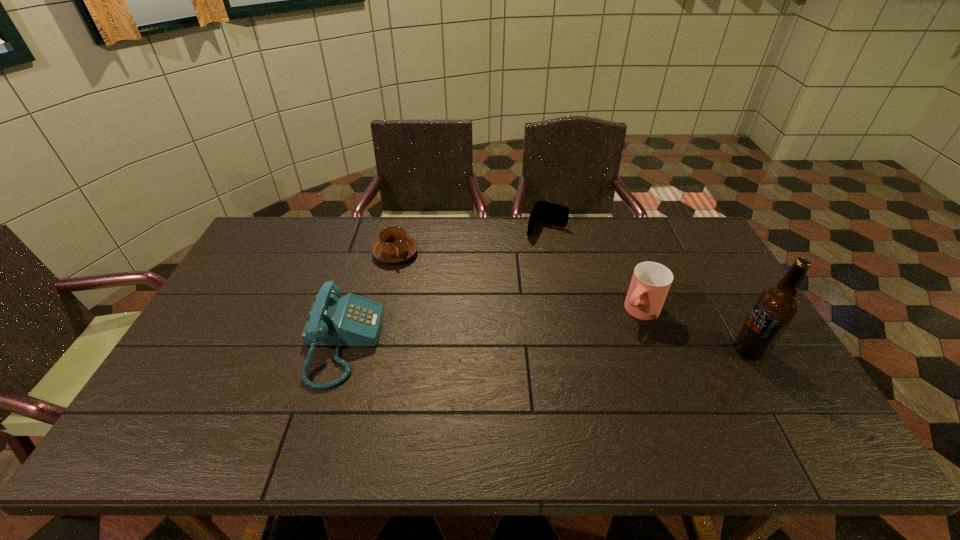
Where is `free location located on the label of the tallest object`? This screenshot has height=540, width=960. free location located on the label of the tallest object is located at coordinates (697, 350).

The image size is (960, 540). Find the location of `vacant space located on the side of the fourth object from left to right with the handle`. vacant space located on the side of the fourth object from left to right with the handle is located at coordinates (570, 379).

You are a GUI agent. You are given a task and a screenshot of the screen. Output one action in this format:
    pyautogui.click(x=<x>, y=<y>)
    Task: Click on the vacant space located 0.340m on the side of the fourth object from left to right with the handle
    This screenshot has width=960, height=540.
    Given the screenshot: What is the action you would take?
    pyautogui.click(x=556, y=394)

Where is `free space located 0.340m on the side of the fourth object from left to right with the handle`? The width and height of the screenshot is (960, 540). free space located 0.340m on the side of the fourth object from left to right with the handle is located at coordinates (556, 394).

I want to click on free space located on the side of the cappuccino with the handle, so click(479, 333).

The height and width of the screenshot is (540, 960). In order to click on free space located on the side of the cappuccino with the handle in this screenshot , I will do `click(422, 279)`.

Where is `vacant space situated on the side of the cappuccino with the handle`? The width and height of the screenshot is (960, 540). vacant space situated on the side of the cappuccino with the handle is located at coordinates (431, 287).

Locate an element on the screen. vacant space located 0.260m on the outer surface of the farthest object is located at coordinates (516, 284).

I want to click on vacant space located on the outer surface of the farthest object, so click(x=519, y=278).

This screenshot has height=540, width=960. In order to click on free space located on the outer surface of the farthest object in this screenshot , I will do `click(535, 249)`.